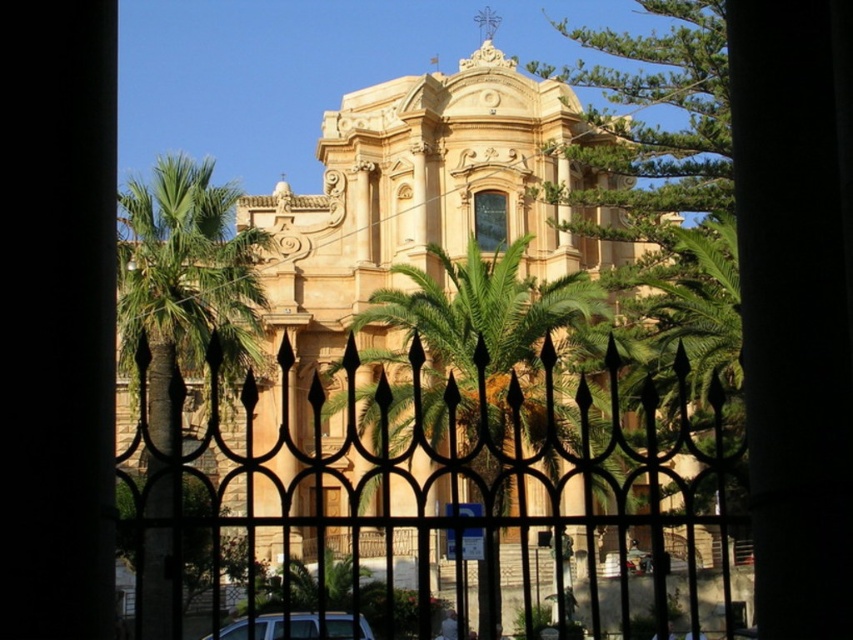
Question: Does green leafy tree at upper right have a greater width compared to silver metallic car at lower center?

Choices:
 (A) yes
 (B) no

Answer: (A)

Question: Is the position of green leafy tree at upper right less distant than that of silver metallic car at lower center?

Choices:
 (A) yes
 (B) no

Answer: (B)

Question: Which object is the farthest from the green leafy palm tree at center?

Choices:
 (A) black wrought iron fence at center
 (B) green leafy tree at upper right
 (C) silver metallic car at lower center

Answer: (C)

Question: Can you confirm if green leafy palm tree at center is thinner than silver metallic car at lower center?

Choices:
 (A) yes
 (B) no

Answer: (B)

Question: Which of the following is the closest to the observer?

Choices:
 (A) click(335, 477)
 (B) click(708, 170)
 (C) click(582, 346)

Answer: (A)

Question: Which object is positioned farthest from the black wrought iron fence at center?

Choices:
 (A) silver metallic car at lower center
 (B) green leafy palm tree at center
 (C) green leafy tree at upper right

Answer: (C)